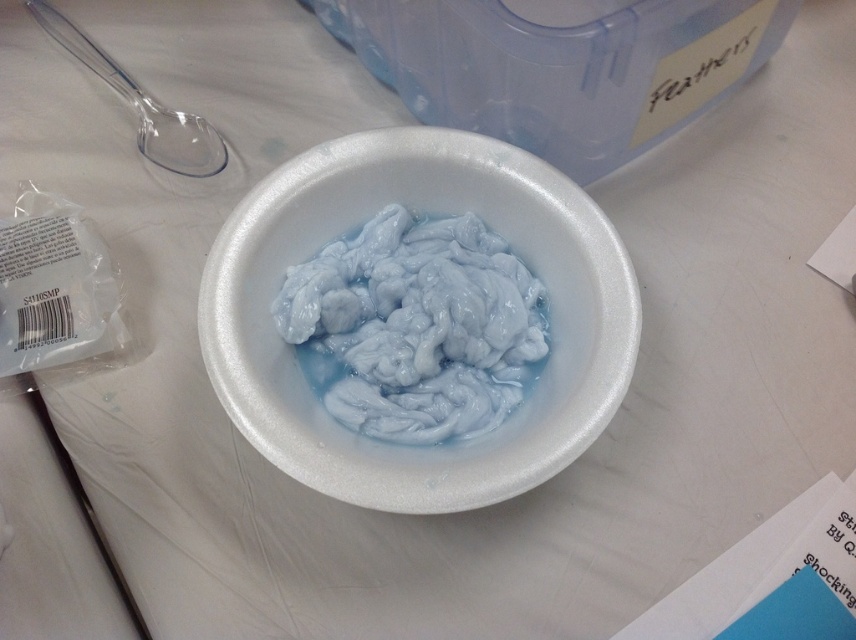
Consider the image. Who is taller, white rubbery substance at center or transparent plastic spoon at upper left?

Standing taller between the two is white rubbery substance at center.

Can you confirm if white rubbery substance at center is thinner than transparent plastic spoon at upper left?

No.

Does point (432, 440) come closer to viewer compared to point (140, 125)?

Yes, it is.

The height and width of the screenshot is (640, 856). In order to click on white rubbery substance at center in this screenshot , I will do `click(415, 326)`.

Does white styrofoam bowl at center have a smaller size compared to white rubbery substance at center?

Incorrect, white styrofoam bowl at center is not smaller in size than white rubbery substance at center.

Which is more to the right, white styrofoam bowl at center or white rubbery substance at center?

From the viewer's perspective, white styrofoam bowl at center appears more on the right side.

Is point (296, 477) positioned after point (447, 340)?

No, it is not.

The height and width of the screenshot is (640, 856). What are the coordinates of `white styrofoam bowl at center` in the screenshot? It's located at [352, 435].

Does white styrofoam bowl at center have a lesser width compared to transparent plastic spoon at upper left?

In fact, white styrofoam bowl at center might be wider than transparent plastic spoon at upper left.

Is white styrofoam bowl at center shorter than transparent plastic spoon at upper left?

No, white styrofoam bowl at center is not shorter than transparent plastic spoon at upper left.

Between point (450, 490) and point (176, 120), which one is positioned behind?

The point (176, 120) is behind.

Locate an element on the screen. The width and height of the screenshot is (856, 640). white styrofoam bowl at center is located at coordinates (352, 435).